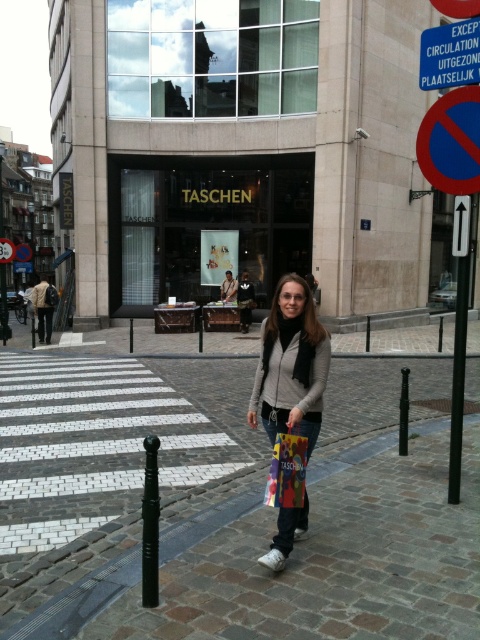
You are standing at the entrance of the TASCHEN store and want to place a small potted plant exactly where the brown cobblestone at center is located. What coordinates should you use?

The coordinates for the brown cobblestone at center are 0.795 in the x direction and 0.481 in the y direction.

You are a delivery person trying to park your bike near the TASCHEN store. You notice a red plastic circle at upper right and a blue plastic sign at upper center. Which parking area is wider for your bike?

The red plastic circle at upper right is wider than the blue plastic sign at upper center, so the parking area with the red plastic circle at upper right can accommodate a wider bike.